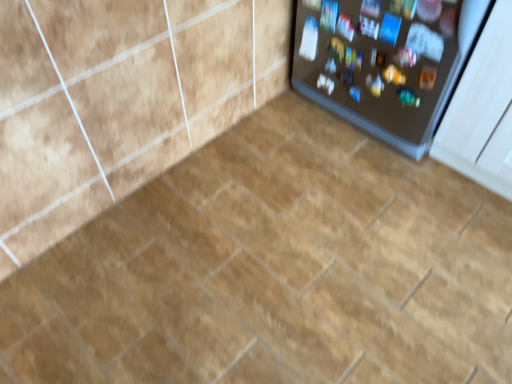
What are the coordinates of `satin silver fridge at upper right` in the screenshot? It's located at (385, 62).

This screenshot has height=384, width=512. What do you see at coordinates (385, 62) in the screenshot?
I see `satin silver fridge at upper right` at bounding box center [385, 62].

Image resolution: width=512 pixels, height=384 pixels. I want to click on satin silver fridge at upper right, so click(x=385, y=62).